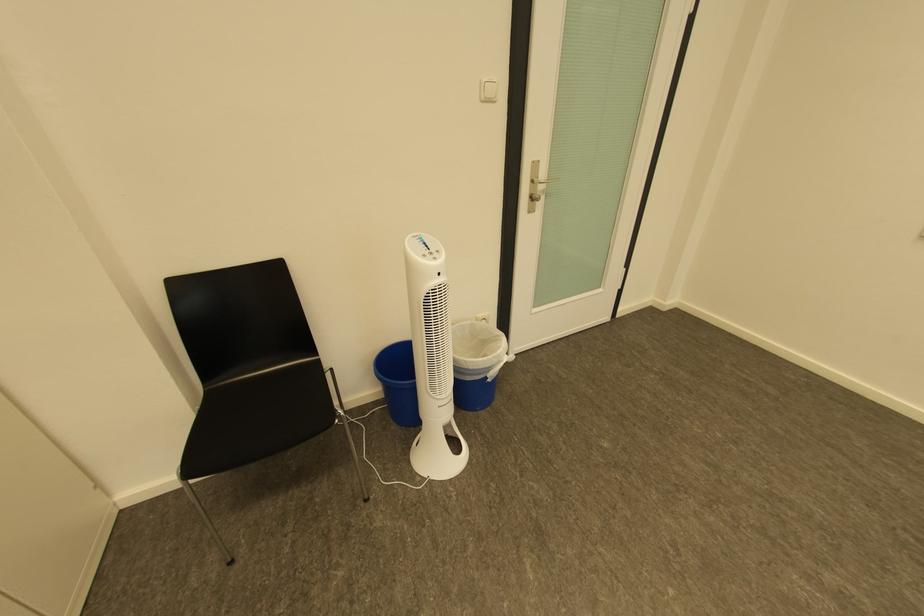
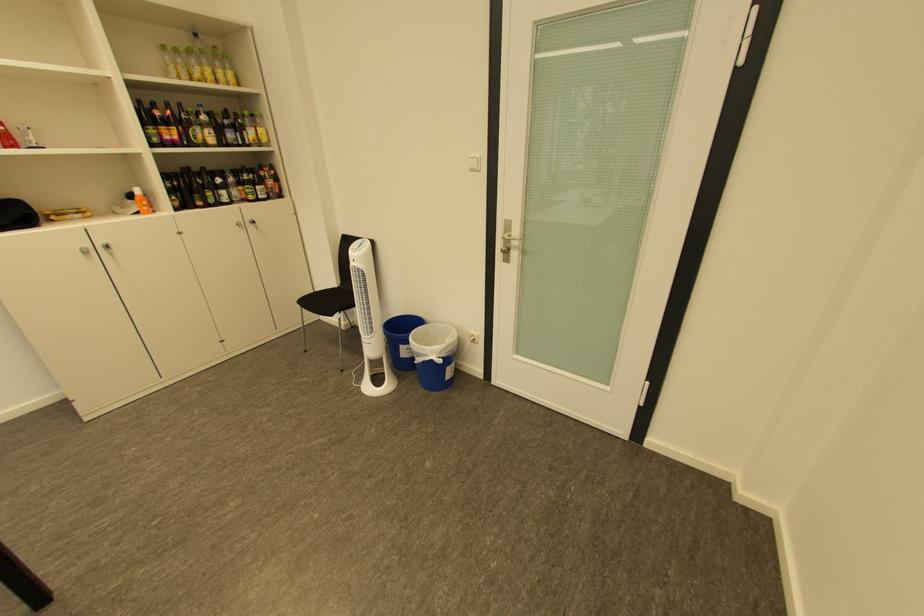
The point at (499, 370) is marked in the first image. Where is the corresponding point in the second image?

(429, 355)